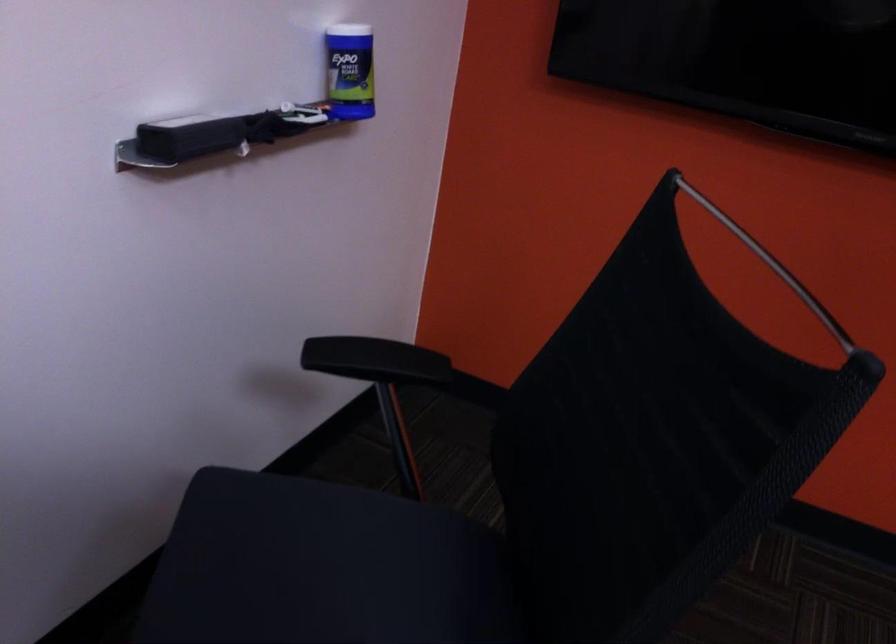
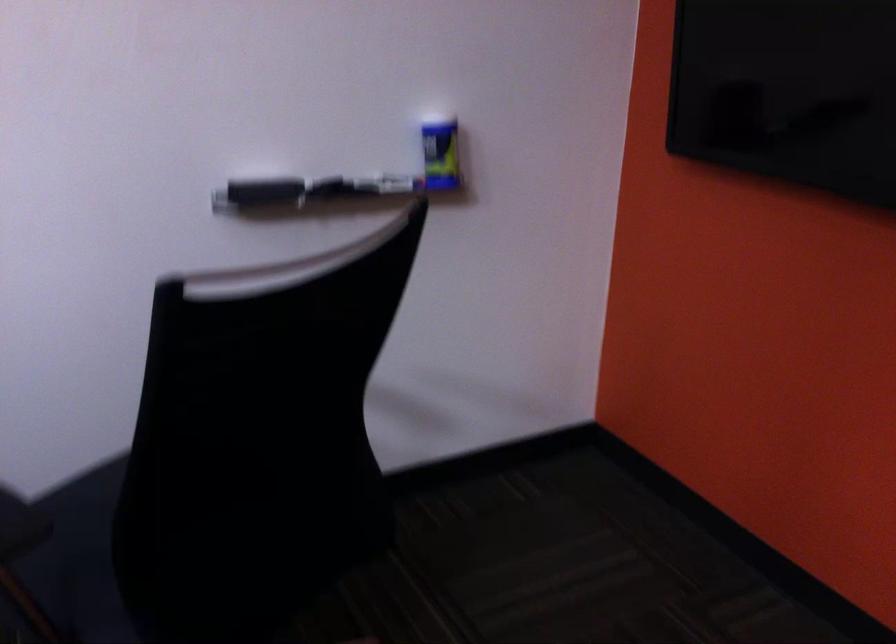
The point at (360, 80) is marked in the first image. Where is the corresponding point in the second image?

(440, 156)